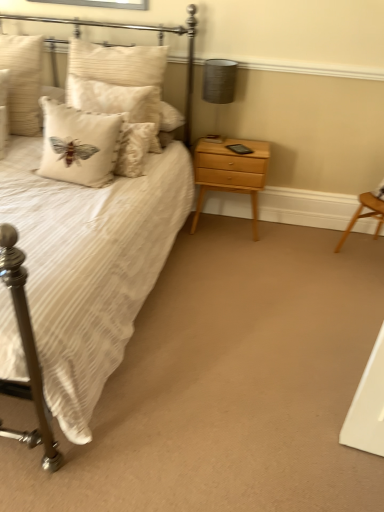
Question: Is point (210, 83) positioned closer to the camera than point (46, 174)?

Choices:
 (A) farther
 (B) closer

Answer: (A)

Question: From the image's perspective, relative to white textured cushion at upper left, arranged as the 2th pillow when viewed from the left, is matte gray lampshade at upper right above or below?

Choices:
 (A) above
 (B) below

Answer: (A)

Question: Which object is positioned closest to the light wood/texture nightstand at right?

Choices:
 (A) white textured cushion at upper left, which appears as the second pillow when viewed from the right
 (B) white textured pillow at upper left, the 1th pillow viewed from the right
 (C) beige textured pillow at upper left, the third pillow from the right
 (D) white striped fabric bed at left
 (E) matte gray lampshade at upper right

Answer: (E)

Question: Which of these objects is positioned farthest from the white striped fabric bed at left?

Choices:
 (A) matte gray lampshade at upper right
 (B) white textured pillow at upper left, the 1th pillow viewed from the right
 (C) white textured cushion at upper left, arranged as the 2th pillow when viewed from the left
 (D) light wood/texture nightstand at right
 (E) beige textured pillow at upper left, the third pillow from the right

Answer: (C)